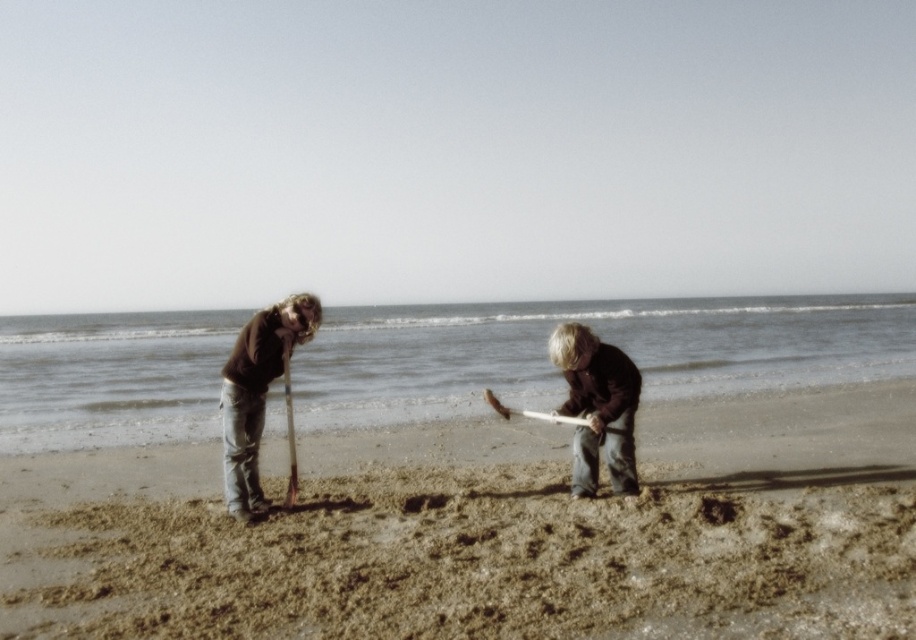
Question: Estimate the real-world distances between objects in this image. Which object is farther from the brown sandy beach at center?

Choices:
 (A) wooden stick at center
 (B) matte brown sweater at left

Answer: (A)

Question: Which point is closer to the camera?

Choices:
 (A) matte brown sweater at left
 (B) brown sandy beach at center
 (C) wooden stick at center

Answer: (B)

Question: Does wooden stick at center have a larger size compared to matte brown sweater at left?

Choices:
 (A) yes
 (B) no

Answer: (B)

Question: Which point is closer to the camera taking this photo?

Choices:
 (A) (554, 333)
 (B) (258, 424)

Answer: (A)

Question: Is wooden stick at center bigger than matte brown sweater at left?

Choices:
 (A) yes
 (B) no

Answer: (B)

Question: Does wooden stick at center have a greater width compared to matte brown sweater at left?

Choices:
 (A) no
 (B) yes

Answer: (A)